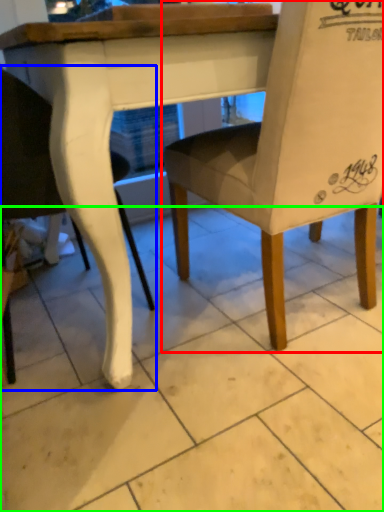
Question: Based on their relative distances, which object is farther from chair (highlighted by a red box)? Choose from chair (highlighted by a blue box) and tile (highlighted by a green box).

Choices:
 (A) chair
 (B) tile

Answer: (A)